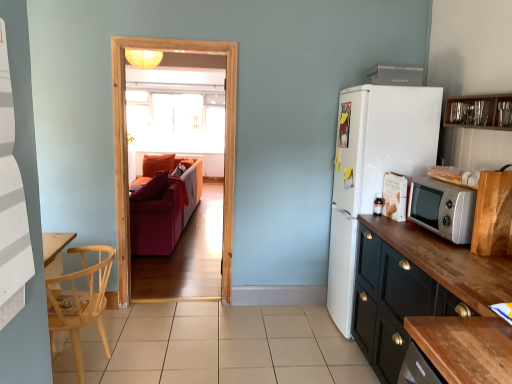
Question: Is point (76, 251) positioned closer to the camera than point (225, 203)?

Choices:
 (A) farther
 (B) closer

Answer: (B)

Question: Is natural wood chair at left bigger or smaller than transparent glass door at center?

Choices:
 (A) small
 (B) big

Answer: (B)

Question: Which object is positioned farthest from the white matte refrigerator at right?

Choices:
 (A) transparent glass door at center
 (B) clear glass cabinet at upper right, which is the first cabinetry in top-to-bottom order
 (C) clear glass window at center
 (D) beige tile at center
 (E) velvet red couch at center

Answer: (C)

Question: Which is farther from the clear glass window at center?

Choices:
 (A) white matte refrigerator at right
 (B) velvet red couch at center
 (C) silver metallic microwave oven at right
 (D) wooden cabinet at right, which ranks as the 2th cabinetry in top-to-bottom order
 (E) black wood cabinet at right, which is the third cabinetry from top to bottom

Answer: (D)